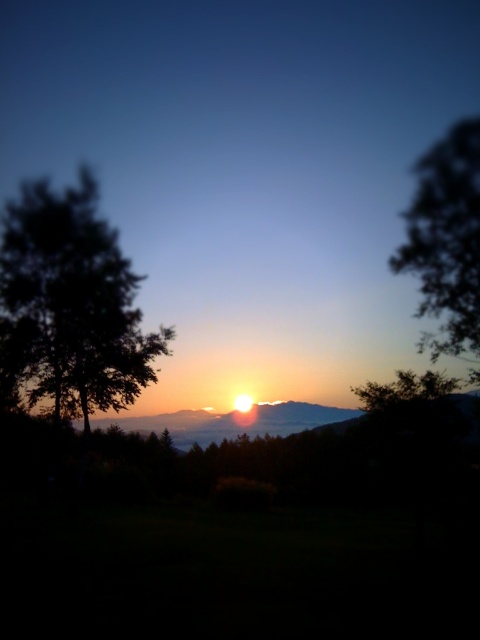
Which of these two, dark green leafy tree at left or silhouette leafy tree at right, stands shorter?

Standing shorter between the two is silhouette leafy tree at right.

Which is above, dark green leafy tree at left or silhouette leafy tree at right?

silhouette leafy tree at right

Where is `dark green leafy tree at left`? The height and width of the screenshot is (640, 480). dark green leafy tree at left is located at coordinates (72, 301).